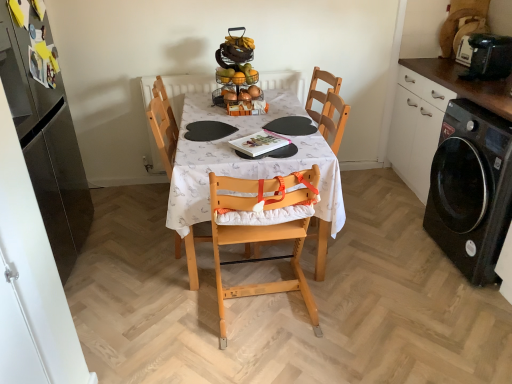
Locate an element on the screen. Image resolution: width=512 pixels, height=384 pixels. free spot in front of light wood highchair at center, which is counted as the 2th chair, starting from the right is located at coordinates (179, 289).